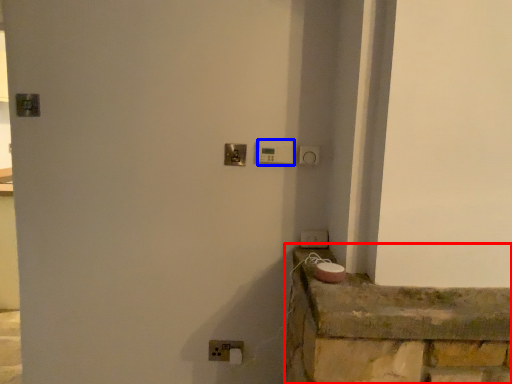
Question: Which object is closer to the camera taking this photo, ledge (highlighted by a red box) or light switch (highlighted by a blue box)?

Choices:
 (A) ledge
 (B) light switch

Answer: (A)